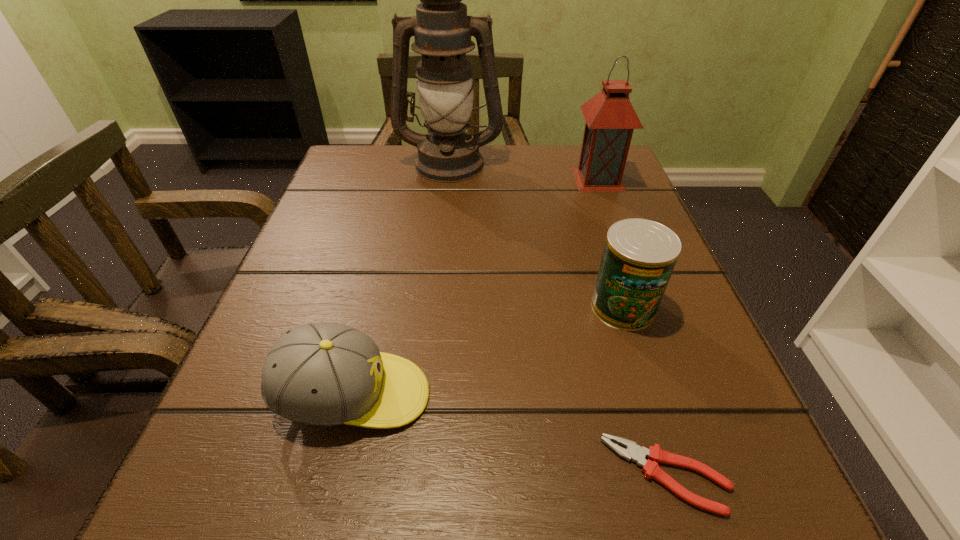
At what (x,y) coordinates should I click in order to perform the action: click on free space located 0.320m on the back of the shortest object. Please return your answer as a coordinate pair (x, y). The height and width of the screenshot is (540, 960). Looking at the image, I should click on (602, 263).

Where is `oil lamp that is at the far edge`? The height and width of the screenshot is (540, 960). oil lamp that is at the far edge is located at coordinates (442, 30).

I want to click on lantern that is at the far edge, so click(x=610, y=118).

This screenshot has height=540, width=960. What are the coordinates of `object present at the near edge` in the screenshot? It's located at (636, 453).

You are a GUI agent. You are given a task and a screenshot of the screen. Output one action in this format:
    pyautogui.click(x=<x>, y=<y>)
    Task: Click on the oil lamp positioned at the left edge
    
    Given the screenshot: What is the action you would take?
    pyautogui.click(x=442, y=30)

This screenshot has width=960, height=540. I want to click on baseball cap that is positioned at the left edge, so click(326, 374).

Find the location of a particular element. lantern at the right edge is located at coordinates (610, 118).

The image size is (960, 540). Identify the location of can present at the right edge. (639, 255).

Where is `pliers present at the right edge`? pliers present at the right edge is located at coordinates (636, 453).

Locate an element on the screen. object located in the far left corner section of the desktop is located at coordinates (442, 30).